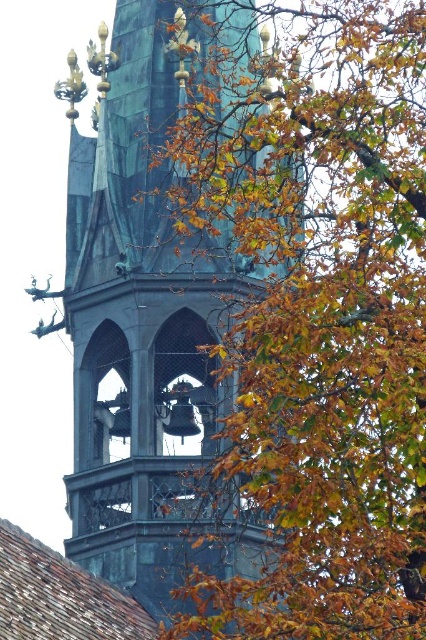
You are an architect examining the church tower. You notice autumn leaves at upper right and the green patina tower at center. Which object occupies more horizontal space in the image?

The autumn leaves at upper right occupy more horizontal space than the green patina tower at center because the autumn leaves at upper right has a larger width.

You are standing in front of the historic church tower. You notice two points marked on the tower. The first point is at coordinate point (195, 90) and the second is at point (126, 113). Which point do you see closer to you?

Point (195, 90) is closer to the camera than point (126, 113), so you see point (195, 90) closer to you.

You are an artist sketching the historic church tower. You notice autumn leaves at upper right and the green patina tower at center. Which object should you draw first if you want to depict the larger one first?

The autumn leaves at upper right should be drawn first because they are larger in size than the green patina tower at center according to the description.